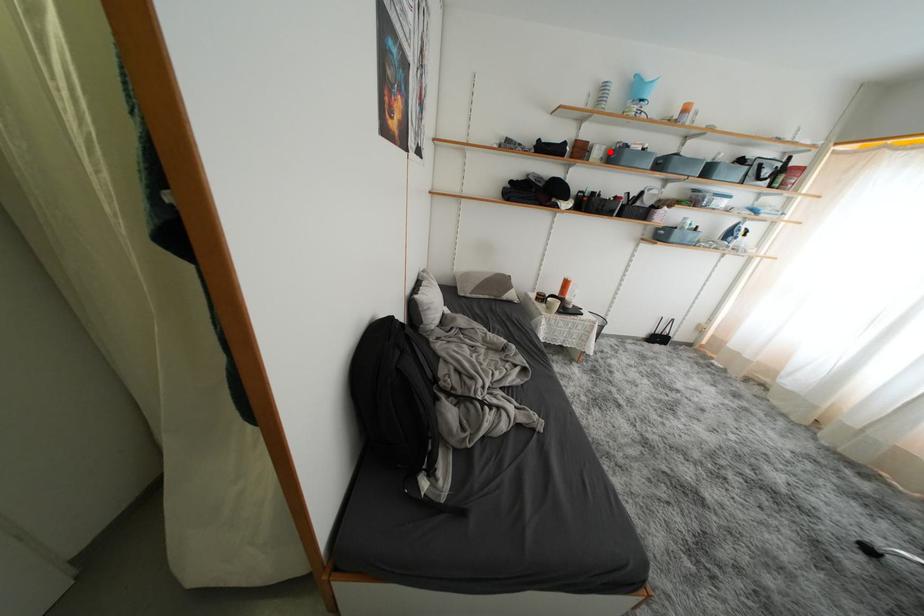
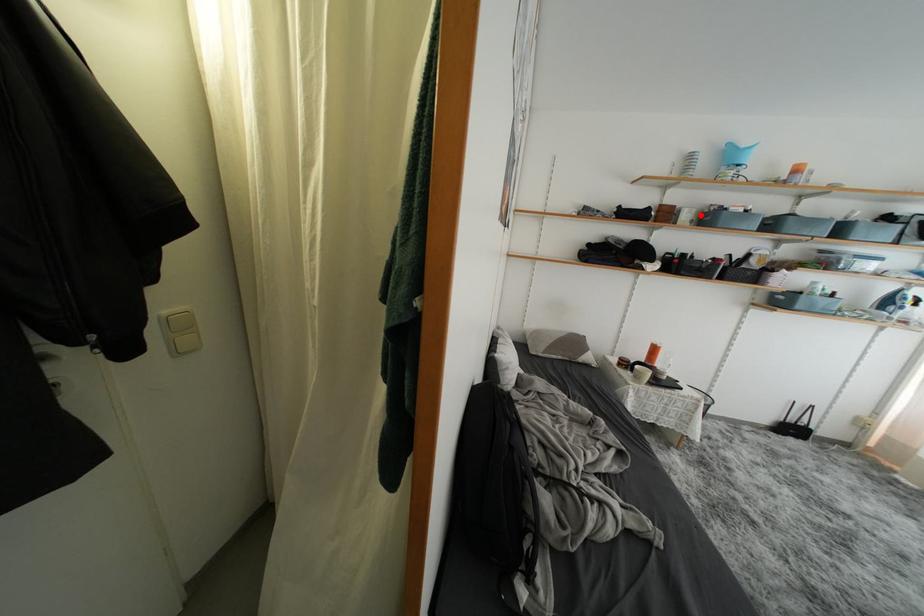
Consider the image. I am providing you with two images of the same scene from different viewpoints. A red point is marked on the first image and another point is marked on the second image. Is the red point in image1 aligned with the point shown in image2?

Yes